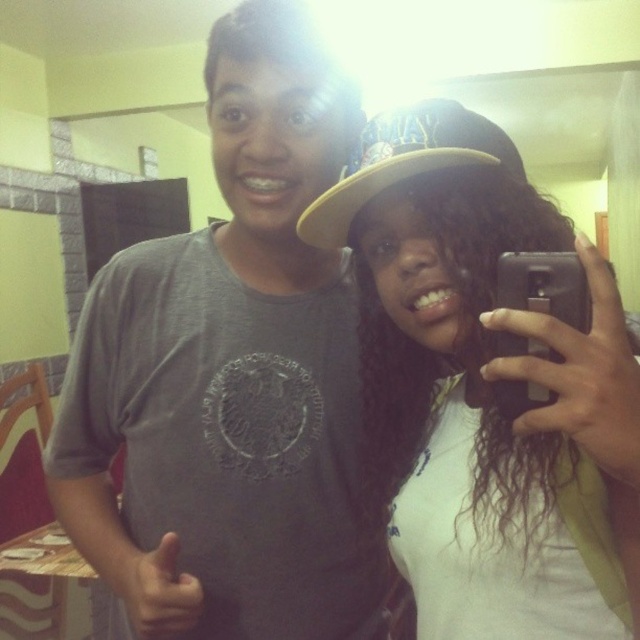
You are trying to locate the white matte hat at upper center in the image. Based on the coordinates given, where exactly is it positioned?

The white matte hat at upper center is located at coordinates point (484, 388).

You are a photographer standing at the camera position. You want to take a closeup shot of the white matte hat at upper center. The lens you have can focus on objects within 35 centimeters. Do you need to move closer or farther away to get a clear focus?

The white matte hat at upper center is 38.99 centimeters from the camera. Since the lens can only focus within 35 centimeters, you need to move closer to the white matte hat at upper center to get a clear focus.

Based on the photo, you are trying to decide which hat to buy based on the image. The white matte hat at upper center and the tan fabric baseball cap at upper right are both visible. Which one appears nearer to you in the photo?

The white matte hat at upper center is closer to the viewer than the tan fabric baseball cap at upper right, so it appears nearer in the photo.